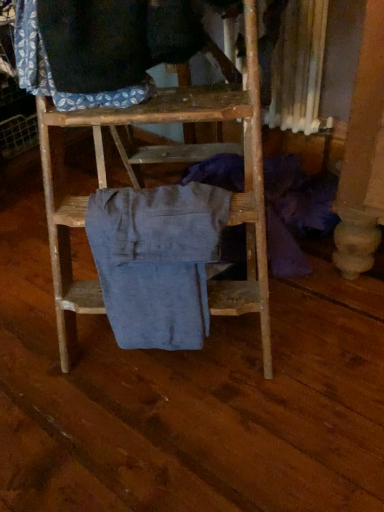
Question: Is denim pants at center, placed as the 1th clothing when sorted from bottom to top, to the left of blue patterned fabric at upper left, the 2th clothing from the bottom, from the viewer's perspective?

Choices:
 (A) yes
 (B) no

Answer: (B)

Question: Can you confirm if denim pants at center, placed as the 1th clothing when sorted from bottom to top, is bigger than blue patterned fabric at upper left, the 2th clothing from the bottom?

Choices:
 (A) no
 (B) yes

Answer: (B)

Question: Is denim pants at center, which is counted as the 2th clothing, starting from the top, positioned behind blue patterned fabric at upper left, the first clothing when ordered from left to right?

Choices:
 (A) no
 (B) yes

Answer: (B)

Question: Is denim pants at center, placed as the 1th clothing when sorted from bottom to top, positioned far away from blue patterned fabric at upper left, which ranks as the first clothing in top-to-bottom order?

Choices:
 (A) no
 (B) yes

Answer: (A)

Question: Is denim pants at center, placed as the 1th clothing when sorted from bottom to top, smaller than blue patterned fabric at upper left, the 2th clothing from the bottom?

Choices:
 (A) no
 (B) yes

Answer: (A)

Question: Is the position of denim pants at center, placed as the 1th clothing when sorted from bottom to top, less distant than that of blue patterned fabric at upper left, which ranks as the first clothing in top-to-bottom order?

Choices:
 (A) yes
 (B) no

Answer: (B)

Question: Is blue patterned fabric at upper left, which ranks as the first clothing in top-to-bottom order, thinner than denim pants at center, which is counted as the 2th clothing, starting from the top?

Choices:
 (A) yes
 (B) no

Answer: (A)

Question: Is blue patterned fabric at upper left, placed as the second clothing when sorted from right to left, closer to camera compared to denim pants at center, which is counted as the 2th clothing, starting from the top?

Choices:
 (A) yes
 (B) no

Answer: (A)

Question: Can you confirm if blue patterned fabric at upper left, which ranks as the first clothing in top-to-bottom order, is positioned to the left of denim pants at center, the first clothing positioned from the right?

Choices:
 (A) no
 (B) yes

Answer: (B)

Question: Is blue patterned fabric at upper left, which ranks as the first clothing in top-to-bottom order, touching denim pants at center, the first clothing positioned from the right?

Choices:
 (A) yes
 (B) no

Answer: (B)

Question: Does blue patterned fabric at upper left, placed as the second clothing when sorted from right to left, have a smaller size compared to denim pants at center, the 2th clothing when ordered from left to right?

Choices:
 (A) yes
 (B) no

Answer: (A)

Question: Is blue patterned fabric at upper left, the first clothing when ordered from left to right, completely or partially outside of denim pants at center, which is counted as the 2th clothing, starting from the top?

Choices:
 (A) no
 (B) yes

Answer: (B)

Question: From the image's perspective, is blue patterned fabric at upper left, the 2th clothing from the bottom, above or below denim pants at center, which is counted as the 2th clothing, starting from the top?

Choices:
 (A) below
 (B) above

Answer: (B)